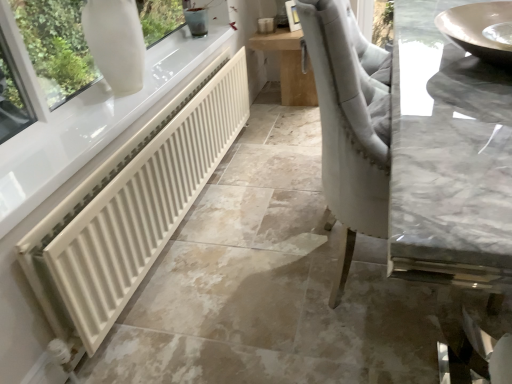
Question: Is wooden table at center shorter than matte gray sink at upper right?

Choices:
 (A) yes
 (B) no

Answer: (B)

Question: From the image's perspective, would you say wooden table at center is positioned over matte gray sink at upper right?

Choices:
 (A) no
 (B) yes

Answer: (B)

Question: From a real-world perspective, is wooden table at center over matte gray sink at upper right?

Choices:
 (A) no
 (B) yes

Answer: (A)

Question: Would you say wooden table at center contains matte gray sink at upper right?

Choices:
 (A) yes
 (B) no

Answer: (B)

Question: Is wooden table at center located outside matte gray sink at upper right?

Choices:
 (A) no
 (B) yes

Answer: (B)

Question: Is matte gray sink at upper right situated inside white matte radiator at lower left or outside?

Choices:
 (A) inside
 (B) outside

Answer: (B)

Question: Considering the positions of matte gray sink at upper right and white matte radiator at lower left in the image, is matte gray sink at upper right bigger or smaller than white matte radiator at lower left?

Choices:
 (A) small
 (B) big

Answer: (A)

Question: From the image's perspective, relative to white matte radiator at lower left, is matte gray sink at upper right above or below?

Choices:
 (A) below
 (B) above

Answer: (B)

Question: Considering the positions of matte gray sink at upper right and white matte radiator at lower left in the image, is matte gray sink at upper right taller or shorter than white matte radiator at lower left?

Choices:
 (A) short
 (B) tall

Answer: (A)

Question: From a real-world perspective, is white matte radiator at lower left physically located above or below white glossy vase at upper left?

Choices:
 (A) above
 (B) below

Answer: (B)

Question: Visually, is white matte radiator at lower left positioned to the left or to the right of white glossy vase at upper left?

Choices:
 (A) right
 (B) left

Answer: (A)

Question: From the image's perspective, is white matte radiator at lower left positioned above or below white glossy vase at upper left?

Choices:
 (A) below
 (B) above

Answer: (A)

Question: Is white matte radiator at lower left bigger or smaller than white glossy vase at upper left?

Choices:
 (A) big
 (B) small

Answer: (B)

Question: Is white matte radiator at lower left situated inside matte gray sink at upper right or outside?

Choices:
 (A) outside
 (B) inside

Answer: (A)

Question: In the image, is white matte radiator at lower left positioned in front of or behind matte gray sink at upper right?

Choices:
 (A) behind
 (B) front

Answer: (A)